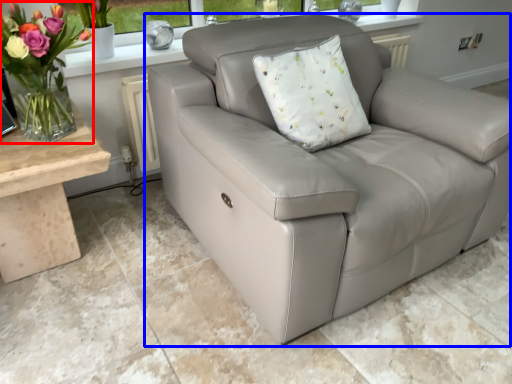
Question: Which point is closer to the camera, floral arrangement (highlighted by a red box) or studio couch (highlighted by a blue box)?

Choices:
 (A) floral arrangement
 (B) studio couch

Answer: (B)